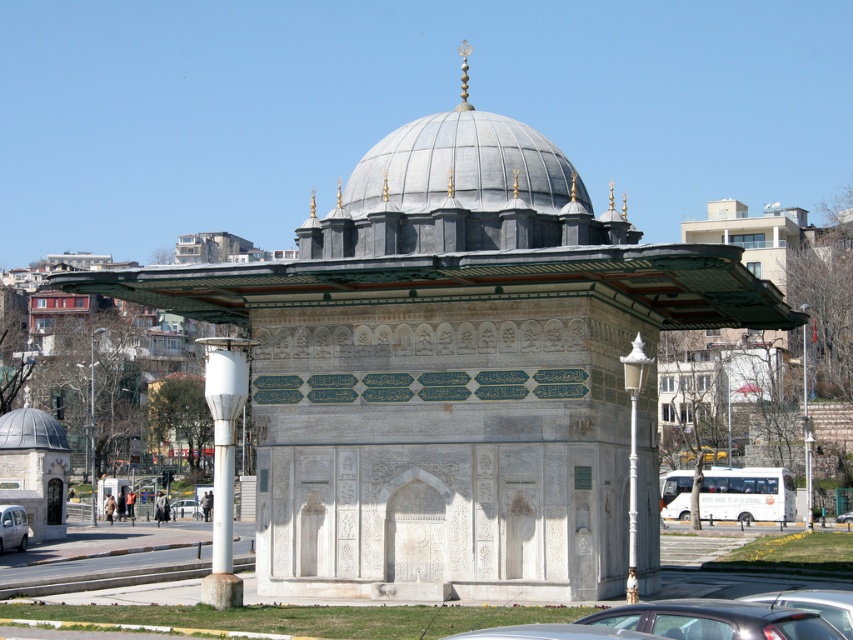
You are a delivery driver who needs to park your car in the parking lot near the Ottoman fountain. You see a shiny black car at center and a silver metallic car at lower left. The parking space between them is 45.75 meters wide. Can your 5.5 meter long delivery van fit between them?

The parking space between the shiny black car at center and the silver metallic car at lower left is 45.75 meters wide. Since your delivery van is only 5.5 meters long, it can easily fit between them with plenty of space to spare.

You are a delivery driver who needs to park your van between the metallic gray sedan at lower center and the white glossy car at center. The van requires a space of 20 feet. Is there enough space between them?

The distance between the metallic gray sedan at lower center and the white glossy car at center is 310.88 feet, so yes, there is more than enough space to park the van between them as the required space is only 20 feet.

You are a photographer planning to capture the gray stone dome at center and the metallic silver car at center in a single frame. Based on their heights, which object should you position closer to the camera to ensure both are fully visible in the photo?

Since the gray stone dome at center is taller than the metallic silver car at center, you should position the metallic silver car at center closer to the camera. This way, the height difference will be balanced, allowing both objects to fit within the frame more effectively.